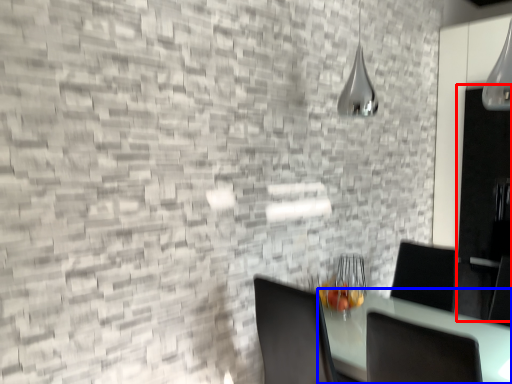
Question: Which object appears closest to the camera in this image, glass door (highlighted by a red box) or table (highlighted by a blue box)?

Choices:
 (A) glass door
 (B) table

Answer: (B)